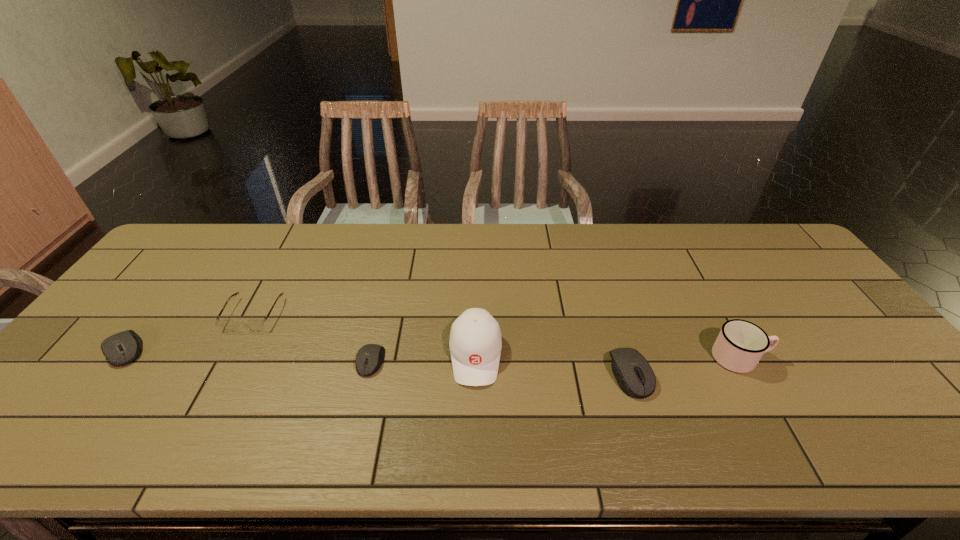
The height and width of the screenshot is (540, 960). Find the location of `free area in between the second object from left to right and the rightmost computer equipment`. free area in between the second object from left to right and the rightmost computer equipment is located at coordinates (443, 345).

The width and height of the screenshot is (960, 540). Identify the location of free space that is in between the leftmost object and the third object from right to left. (300, 352).

Identify the location of the third closest object relative to the second shortest computer equipment. (475, 343).

The width and height of the screenshot is (960, 540). I want to click on object that is the fourth closest to the fifth object from right to left, so click(x=634, y=375).

Where is `computer equipment that is the closest one to the fourth object from left to right`? Image resolution: width=960 pixels, height=540 pixels. computer equipment that is the closest one to the fourth object from left to right is located at coordinates (370, 357).

This screenshot has width=960, height=540. In order to click on the second closest computer equipment to the second computer equipment from left to right in this screenshot , I will do `click(634, 375)`.

The width and height of the screenshot is (960, 540). Find the location of `free space that satisfies the following two spatial constraints: 1. on the front side of the second object from right to left; 2. on the right side of the shortest computer equipment`. free space that satisfies the following two spatial constraints: 1. on the front side of the second object from right to left; 2. on the right side of the shortest computer equipment is located at coordinates (369, 374).

Locate an element on the screen. Image resolution: width=960 pixels, height=540 pixels. free spot that satisfies the following two spatial constraints: 1. on the front-facing side of the tallest computer equipment; 2. on the right side of the fifth object from right to left is located at coordinates (222, 374).

I want to click on free region that satisfies the following two spatial constraints: 1. on the front-facing side of the fifth object from right to left; 2. on the right side of the second object from right to left, so click(x=222, y=374).